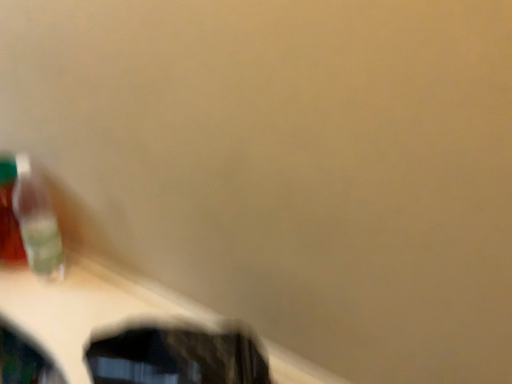
Question: Is point (37, 228) positioned closer to the camera than point (56, 327)?

Choices:
 (A) closer
 (B) farther

Answer: (B)

Question: From the image's perspective, is translucent plastic toothbrush at left positioned above or below wooden table at lower left?

Choices:
 (A) below
 (B) above

Answer: (B)

Question: From a real-world perspective, is translucent plastic toothbrush at left physically located above or below wooden table at lower left?

Choices:
 (A) below
 (B) above

Answer: (B)

Question: Considering the positions of wooden table at lower left and translucent plastic toothbrush at left in the image, is wooden table at lower left wider or thinner than translucent plastic toothbrush at left?

Choices:
 (A) wide
 (B) thin

Answer: (A)

Question: Is wooden table at lower left bigger or smaller than translucent plastic toothbrush at left?

Choices:
 (A) small
 (B) big

Answer: (B)

Question: Is point (106, 279) closer or farther from the camera than point (42, 193)?

Choices:
 (A) closer
 (B) farther

Answer: (B)

Question: Is wooden table at lower left spatially inside translucent plastic toothbrush at left, or outside of it?

Choices:
 (A) outside
 (B) inside

Answer: (A)